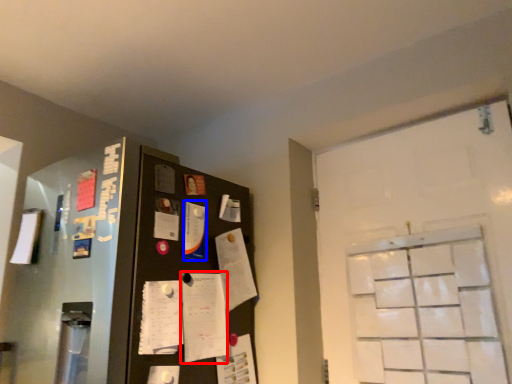
Question: Which object is further to the camera taking this photo, notepad (highlighted by a red box) or paper (highlighted by a blue box)?

Choices:
 (A) notepad
 (B) paper

Answer: (B)